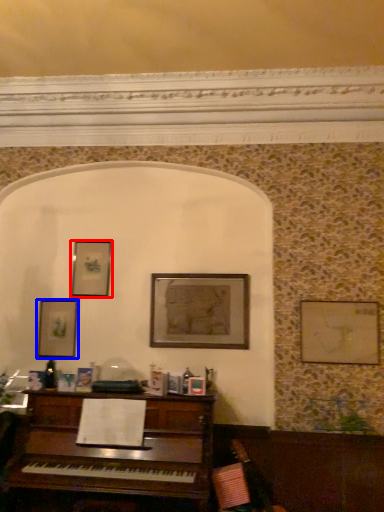
Question: Which point is further to the camera, picture frame (highlighted by a red box) or picture frame (highlighted by a blue box)?

Choices:
 (A) picture frame
 (B) picture frame

Answer: (A)